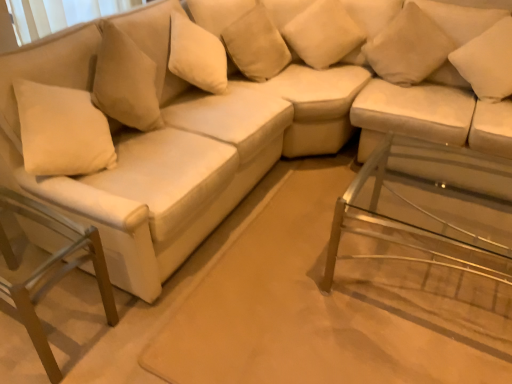
Question: Is beige fabric pillow at upper right, acting as the second pillow starting from the right, wider than beige fabric pillow at upper center, which ranks as the 2th pillow in left-to-right order?

Choices:
 (A) no
 (B) yes

Answer: (B)

Question: Is beige fabric pillow at upper right, placed as the third pillow when sorted from left to right, to the left of beige fabric pillow at upper center, which appears as the 3th pillow when viewed from the right, from the viewer's perspective?

Choices:
 (A) yes
 (B) no

Answer: (B)

Question: Is beige fabric pillow at upper right, placed as the third pillow when sorted from left to right, further to camera compared to beige fabric pillow at upper center, which ranks as the 2th pillow in left-to-right order?

Choices:
 (A) yes
 (B) no

Answer: (B)

Question: Are beige fabric pillow at upper right, acting as the second pillow starting from the right, and beige fabric pillow at upper center, which appears as the 3th pillow when viewed from the right, located far from each other?

Choices:
 (A) yes
 (B) no

Answer: (B)

Question: From the image's perspective, does beige fabric pillow at upper right, acting as the second pillow starting from the right, appear higher than beige fabric pillow at upper center, which ranks as the 2th pillow in left-to-right order?

Choices:
 (A) yes
 (B) no

Answer: (B)

Question: Can you confirm if beige fabric pillow at upper right, acting as the second pillow starting from the right, is positioned to the right of beige fabric pillow at upper center, which appears as the 3th pillow when viewed from the right?

Choices:
 (A) yes
 (B) no

Answer: (A)

Question: Is clear glass side table at lower right touching beige fabric pillow at upper center, which appears as the 3th pillow when viewed from the right?

Choices:
 (A) yes
 (B) no

Answer: (B)

Question: Is clear glass side table at lower right wider than beige fabric pillow at upper center, which ranks as the 2th pillow in left-to-right order?

Choices:
 (A) yes
 (B) no

Answer: (A)

Question: Is clear glass side table at lower right shorter than beige fabric pillow at upper center, which appears as the 3th pillow when viewed from the right?

Choices:
 (A) no
 (B) yes

Answer: (A)

Question: Is clear glass side table at lower right further to the viewer compared to beige fabric pillow at upper center, which ranks as the 2th pillow in left-to-right order?

Choices:
 (A) no
 (B) yes

Answer: (A)

Question: Is clear glass side table at lower right facing away from beige fabric pillow at upper center, which appears as the 3th pillow when viewed from the right?

Choices:
 (A) yes
 (B) no

Answer: (B)

Question: Is clear glass side table at lower right completely or partially outside of beige fabric pillow at upper center, which appears as the 3th pillow when viewed from the right?

Choices:
 (A) yes
 (B) no

Answer: (A)

Question: Does metallic silver swivel chair at lower left contain beige fabric pillow at upper center, which ranks as the 2th pillow in left-to-right order?

Choices:
 (A) yes
 (B) no

Answer: (B)